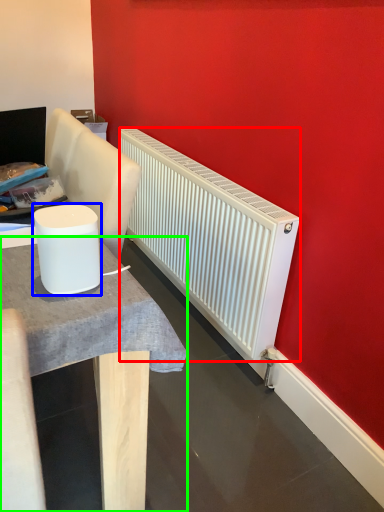
Question: Estimate the real-world distances between objects in this image. Which object is closer to radiator (highlighted by a red box), appliance (highlighted by a blue box) or table (highlighted by a green box)?

Choices:
 (A) appliance
 (B) table

Answer: (B)